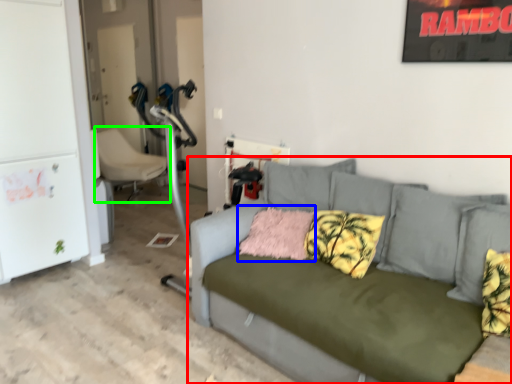
Question: Considering the real-world distances, which object is closest to studio couch (highlighted by a red box)? pillow (highlighted by a blue box) or chair (highlighted by a green box).

Choices:
 (A) pillow
 (B) chair

Answer: (A)